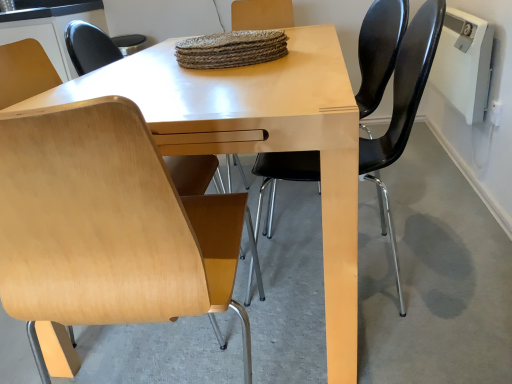
I want to click on free space above beech wood chair at lower left (from a real-world perspective), so click(x=316, y=258).